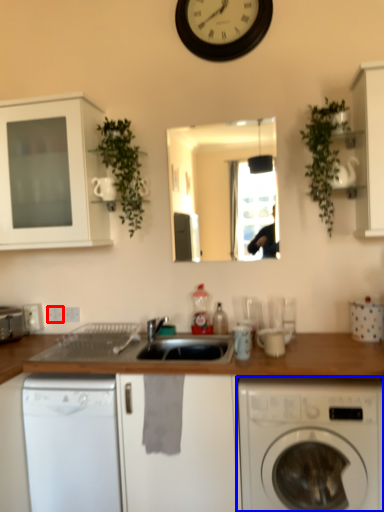
Question: Which object is closer to the camera taking this photo, electric outlet (highlighted by a red box) or washing machine (highlighted by a blue box)?

Choices:
 (A) electric outlet
 (B) washing machine

Answer: (B)